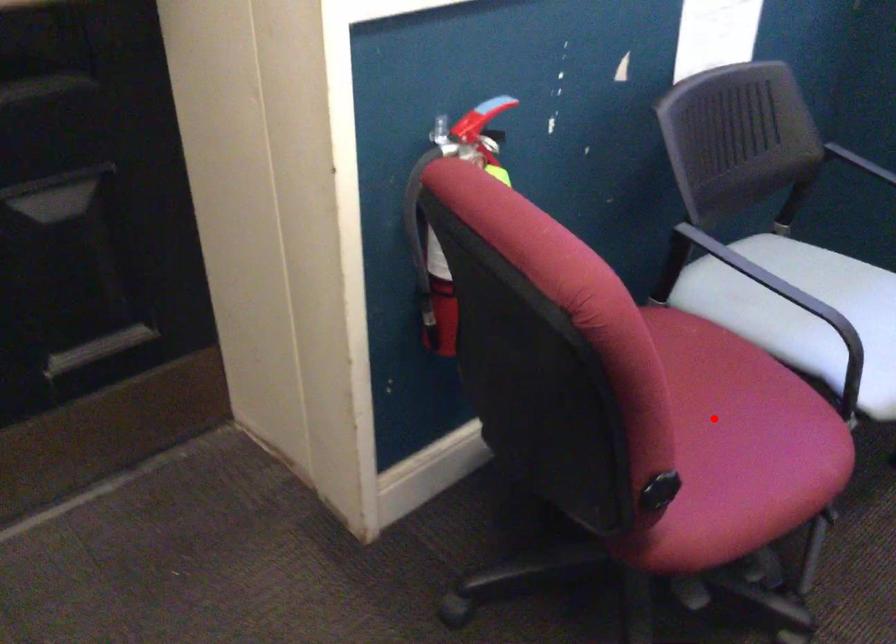
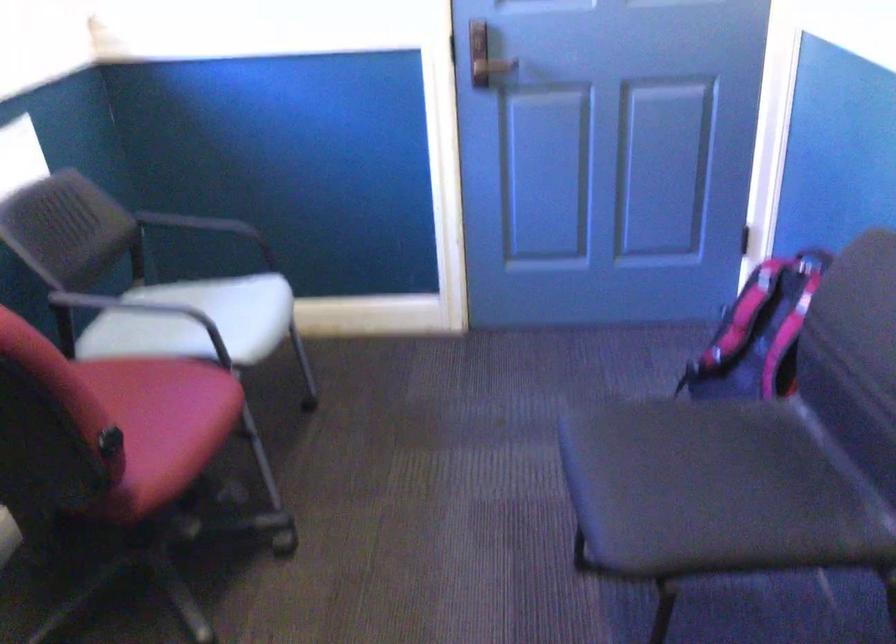
Question: I am providing you with two images of the same scene from different viewpoints. Image1 has a red point marked. In image2, the corresponding 3D location appears at what relative position? Reply with the corresponding letter.

Choices:
 (A) Closer
 (B) Farther

Answer: (B)